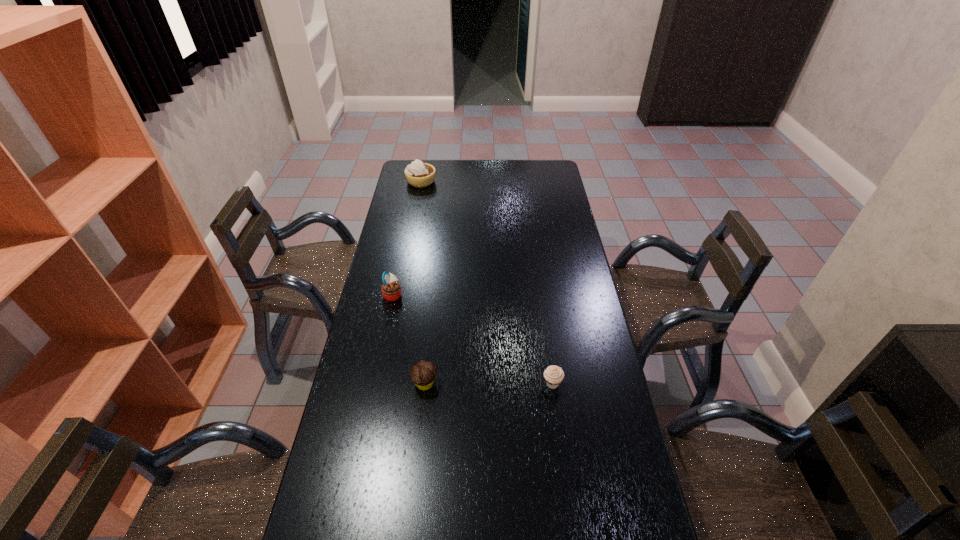
This screenshot has width=960, height=540. Find the location of `whipped cream`. whipped cream is located at coordinates (418, 174).

Find the location of `the third nearest object`. the third nearest object is located at coordinates (391, 290).

In order to click on the leftmost muffin in this screenshot , I will do `click(391, 290)`.

The width and height of the screenshot is (960, 540). I want to click on the rightmost muffin, so click(x=554, y=375).

This screenshot has width=960, height=540. I want to click on the second object from right to left, so click(x=423, y=373).

Image resolution: width=960 pixels, height=540 pixels. Find the location of `vacant region located 0.080m on the front of the farthest object`. vacant region located 0.080m on the front of the farthest object is located at coordinates (418, 198).

Locate an element on the screen. The image size is (960, 540). blank space located on the front-facing side of the farthest muffin is located at coordinates (469, 294).

Identify the location of free space located 0.230m on the front of the rightmost muffin. (564, 468).

The height and width of the screenshot is (540, 960). I want to click on free space located 0.270m on the right of the third object from left to right, so click(525, 383).

Locate an element on the screen. The width and height of the screenshot is (960, 540). object at the far edge is located at coordinates (418, 174).